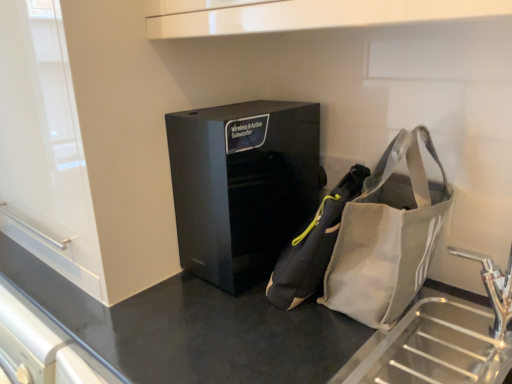
Question: In terms of width, does black matte counter at center look wider or thinner when compared to black glossy speaker at center?

Choices:
 (A) thin
 (B) wide

Answer: (B)

Question: From their relative heights in the image, would you say black matte counter at center is taller or shorter than black glossy speaker at center?

Choices:
 (A) tall
 (B) short

Answer: (A)

Question: Which of these objects is positioned closest to the black glossy speaker at center?

Choices:
 (A) gray fabric pouch at center
 (B) black matte counter at center
 (C) gray fabric bag at lower right

Answer: (A)

Question: Which of these objects is positioned closest to the gray fabric bag at lower right?

Choices:
 (A) gray fabric pouch at center
 (B) black glossy speaker at center
 (C) black matte counter at center

Answer: (A)